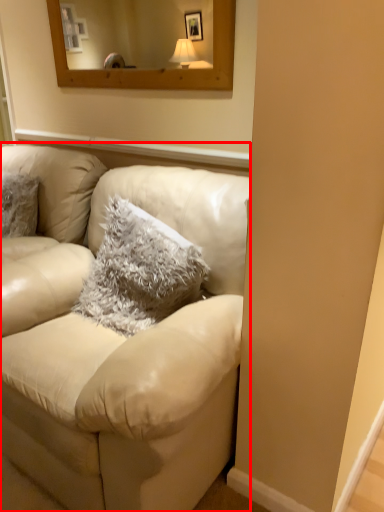
Question: From the image's perspective, where is studio couch (annotated by the red box) located relative to pillow?

Choices:
 (A) below
 (B) above

Answer: (A)